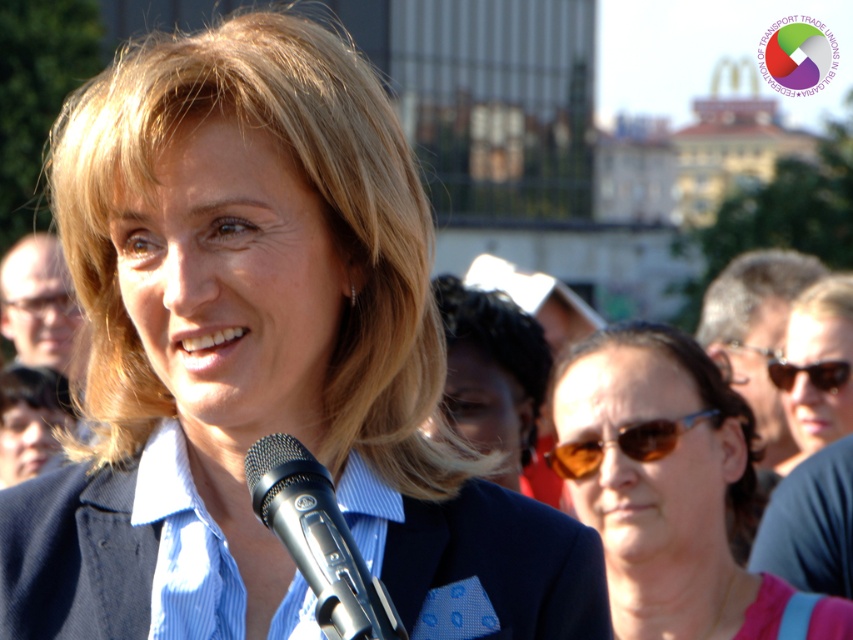
Question: Is blue fabric jacket at center to the left of brown matte sunglasses at center from the viewer's perspective?

Choices:
 (A) yes
 (B) no

Answer: (A)

Question: Which of the following is the farthest from the observer?

Choices:
 (A) sunglasses at center
 (B) dark brown hair at center

Answer: (A)

Question: Which point is farther to the camera?

Choices:
 (A) (815, 291)
 (B) (715, 410)

Answer: (A)

Question: Which object is positioned closest to the dark brown hair at center?

Choices:
 (A) sunglasses at center
 (B) shiny dark sunglasses at center
 (C) silver metallic microphone at center
 (D) blue fabric business suit at center

Answer: (A)

Question: Is blue fabric jacket at center above silver metallic microphone at center?

Choices:
 (A) no
 (B) yes

Answer: (B)

Question: Can you confirm if blue fabric jacket at center is positioned below shiny dark sunglasses at center?

Choices:
 (A) yes
 (B) no

Answer: (B)